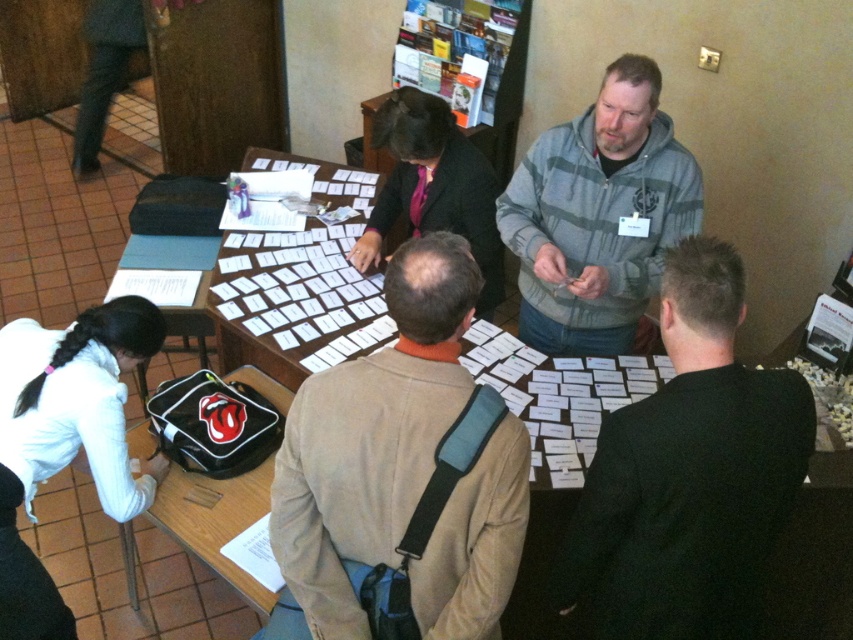
Who is higher up, beige sweater at center or black smooth jacket at center?

beige sweater at center is above.

Does beige sweater at center have a lesser height compared to black smooth jacket at center?

Indeed, beige sweater at center has a lesser height compared to black smooth jacket at center.

Is point (468, 624) positioned before point (701, 524)?

No, (468, 624) is behind (701, 524).

Where is `beige sweater at center`? beige sweater at center is located at coordinates (401, 467).

At what (x,y) coordinates should I click in order to perform the action: click on black smooth jacket at center. Please return your answer as a coordinate pair (x, y). Looking at the image, I should click on (688, 472).

Which is more to the left, wooden table at center or dark gray hoodie at center?

dark gray hoodie at center

How distant is wooden table at center from dark gray hoodie at center?

The distance of wooden table at center from dark gray hoodie at center is 64.40 centimeters.

Who is more forward, (519, 380) or (403, 122)?

Result: Point (519, 380)

At what (x,y) coordinates should I click in order to perform the action: click on wooden table at center. Please return your answer as a coordinate pair (x, y). This screenshot has height=640, width=853. Looking at the image, I should click on (814, 557).